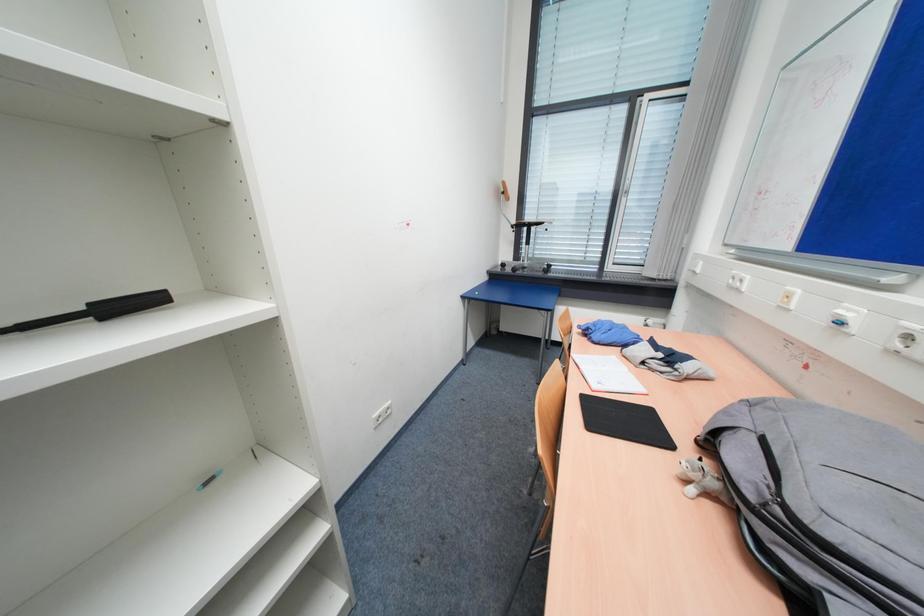
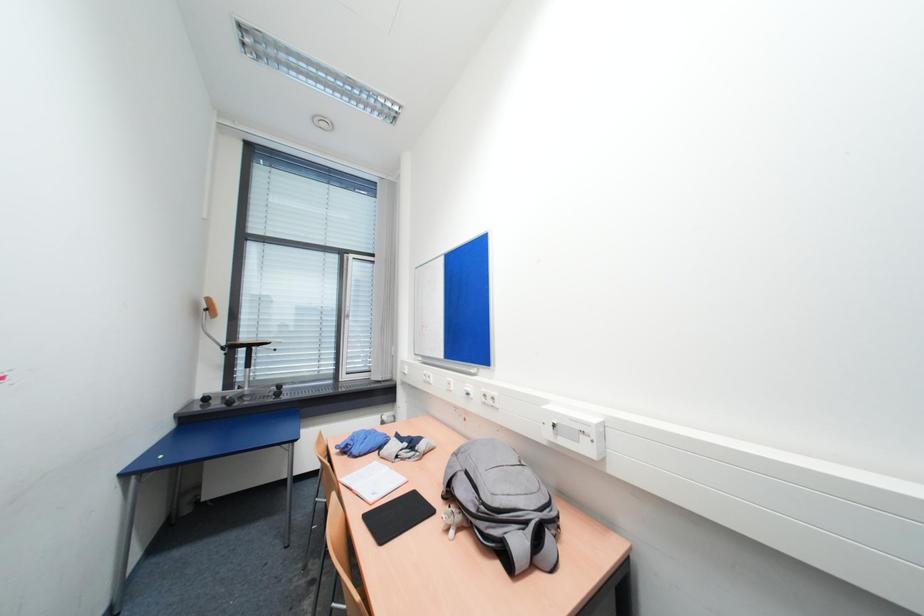
Question: The camera is either moving clockwise (left) or counter-clockwise (right) around the object. The first image is from the beginning of the video and the second image is from the end. Is the camera moving left or right when shooting the video?

Choices:
 (A) Left
 (B) Right

Answer: (A)